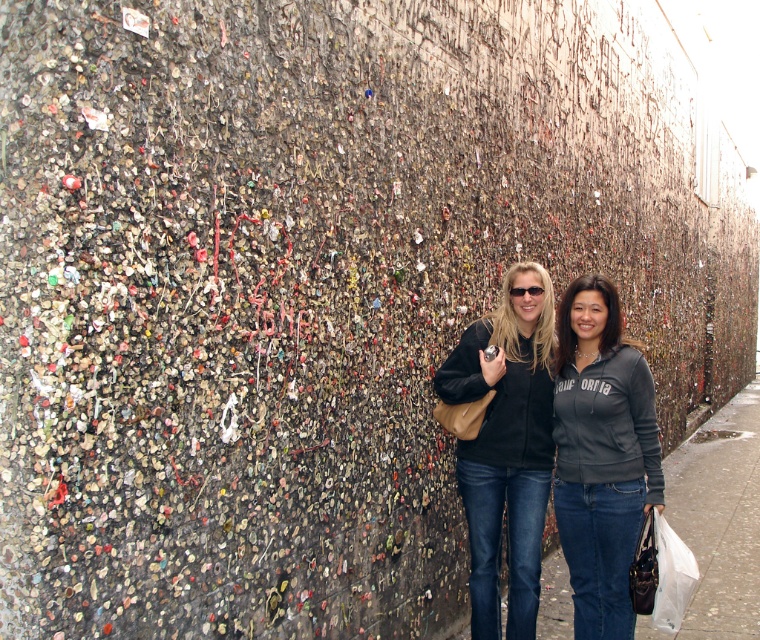
Who is taller, dark gray zip-up jacket at center or matte black jacket at center?

Standing taller between the two is matte black jacket at center.

Can you confirm if dark gray zip-up jacket at center is positioned above matte black jacket at center?

Indeed, dark gray zip-up jacket at center is positioned over matte black jacket at center.

Describe the element at coordinates (600, 456) in the screenshot. The width and height of the screenshot is (760, 640). I see `dark gray zip-up jacket at center` at that location.

Locate an element on the screen. Image resolution: width=760 pixels, height=640 pixels. dark gray zip-up jacket at center is located at coordinates (600, 456).

Is matte black jacket at center behind smooth concrete sidewalk at lower right?

No, it is in front of smooth concrete sidewalk at lower right.

Is point (510, 452) farther from camera compared to point (722, 481)?

No.

Identify the location of matte black jacket at center. The width and height of the screenshot is (760, 640). (505, 445).

How far apart are dark gray zip-up jacket at center and smooth concrete sidewalk at lower right?

dark gray zip-up jacket at center and smooth concrete sidewalk at lower right are 7.12 feet apart from each other.

Which is below, dark gray zip-up jacket at center or smooth concrete sidewalk at lower right?

smooth concrete sidewalk at lower right is lower down.

Find the location of `dark gray zip-up jacket at center`. dark gray zip-up jacket at center is located at coordinates (600, 456).